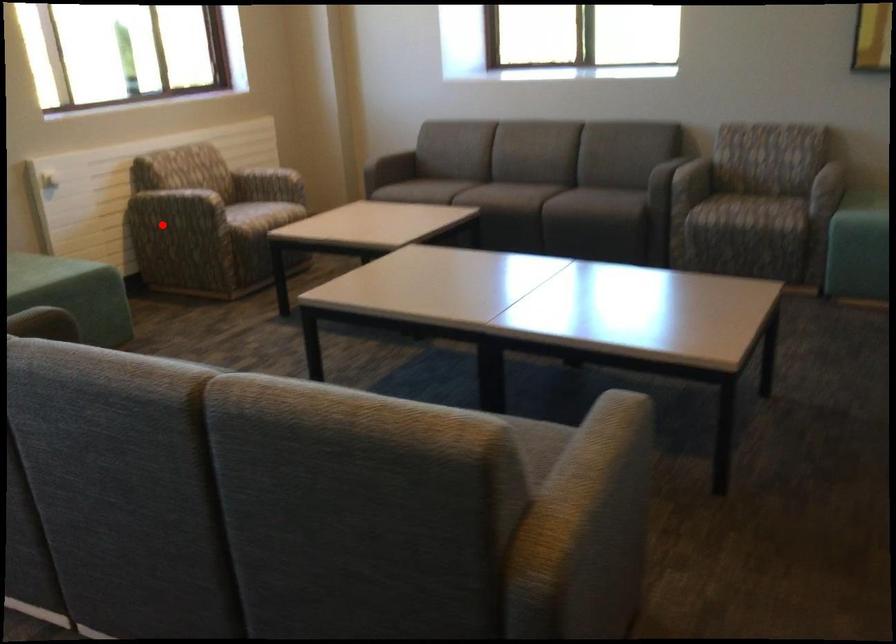
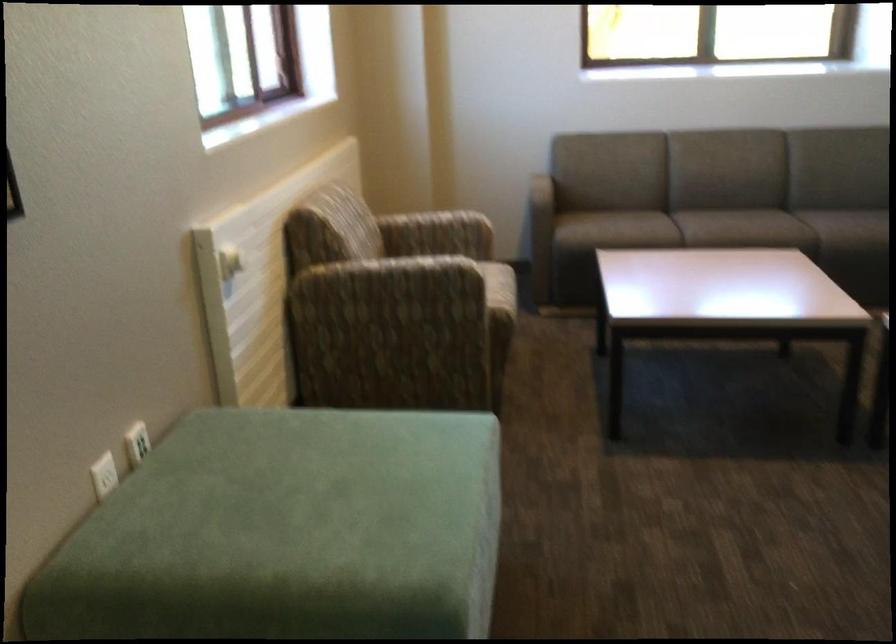
The point at the highlighted location is marked in the first image. Where is the corresponding point in the second image?

(386, 312)